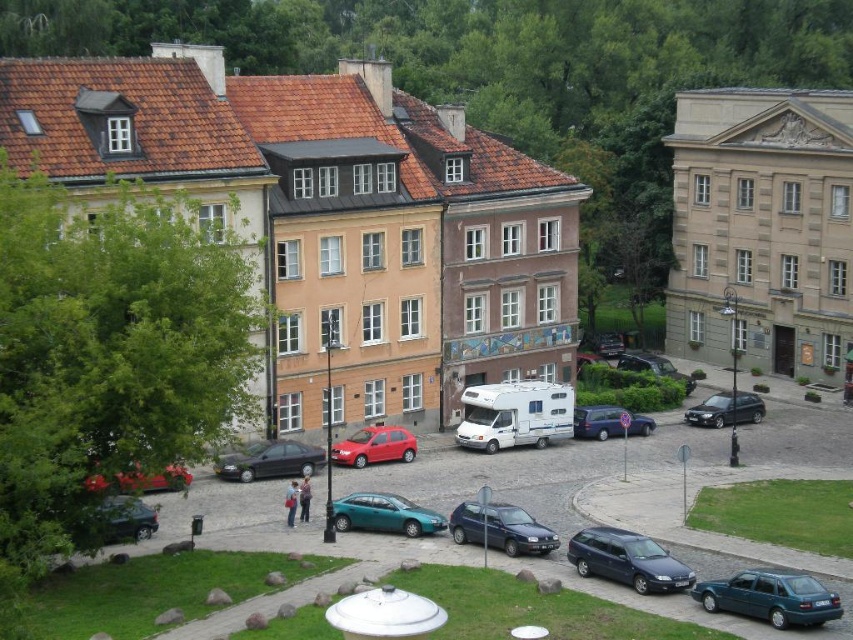
You are a delivery driver who needs to park your truck between the dark blue metallic hatchback at center and the metallic blue van at center. Can your truck fit in the space between them?

The dark blue metallic hatchback at center is bigger than the metallic blue van at center, so the space between them may be sufficient for your truck depending on the exact dimensions. However, since the hatchback is larger, the gap might be narrower than if both were smaller vehicles. Without specific measurements, it is uncertain if the truck will fit.

You are a delivery person trying to park your vehicle in this urban area. You have a delivery van that is taller than the hatchback. Based on the scene, can you safely park your van in the same spot as the dark blue metallic hatchback at center without hitting the metallic blue van at center?

The dark blue metallic hatchback at center is below the metallic blue van at center, which means the van is positioned above the hatchback. Since your delivery van is taller than the hatchback, parking in the same spot might cause a collision with the metallic blue van at center. Choose a different parking spot.